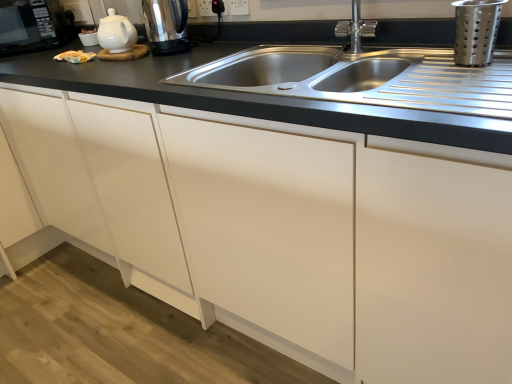
Question: Is black plastic outlet at upper center, marked as the first electric outlet in a left-to-right arrangement, bigger than white glossy teapot at upper left?

Choices:
 (A) yes
 (B) no

Answer: (B)

Question: Is there a large distance between black plastic outlet at upper center, marked as the first electric outlet in a left-to-right arrangement, and white glossy teapot at upper left?

Choices:
 (A) yes
 (B) no

Answer: (B)

Question: Does black plastic outlet at upper center, marked as the first electric outlet in a left-to-right arrangement, have a greater width compared to white glossy teapot at upper left?

Choices:
 (A) no
 (B) yes

Answer: (A)

Question: Does black plastic outlet at upper center, which appears as the second electric outlet when viewed from the right, appear on the right side of white glossy teapot at upper left?

Choices:
 (A) no
 (B) yes

Answer: (B)

Question: From the image's perspective, is black plastic outlet at upper center, marked as the first electric outlet in a left-to-right arrangement, on white glossy teapot at upper left?

Choices:
 (A) no
 (B) yes

Answer: (B)

Question: Considering the relative positions of black plastic outlet at upper center, marked as the first electric outlet in a left-to-right arrangement, and white glossy teapot at upper left in the image provided, is black plastic outlet at upper center, marked as the first electric outlet in a left-to-right arrangement, to the left of white glossy teapot at upper left from the viewer's perspective?

Choices:
 (A) yes
 (B) no

Answer: (B)

Question: From the image's perspective, is metallic silver strainer at upper right, the second appliance in the top-to-bottom sequence, beneath black plastic outlet at upper center, which appears as the second electric outlet when viewed from the right?

Choices:
 (A) no
 (B) yes

Answer: (B)

Question: Are metallic silver strainer at upper right, marked as the first appliance in a front-to-back arrangement, and black plastic outlet at upper center, marked as the first electric outlet in a left-to-right arrangement, located far from each other?

Choices:
 (A) no
 (B) yes

Answer: (A)

Question: Does metallic silver strainer at upper right, arranged as the 1th appliance when ordered from the bottom, have a lesser height compared to black plastic outlet at upper center, which appears as the second electric outlet when viewed from the right?

Choices:
 (A) no
 (B) yes

Answer: (A)

Question: Is metallic silver strainer at upper right, positioned as the 2th appliance in left-to-right order, oriented towards black plastic outlet at upper center, marked as the first electric outlet in a left-to-right arrangement?

Choices:
 (A) yes
 (B) no

Answer: (B)

Question: Considering the relative sizes of metallic silver strainer at upper right, marked as the first appliance in a front-to-back arrangement, and black plastic outlet at upper center, which appears as the second electric outlet when viewed from the right, in the image provided, is metallic silver strainer at upper right, marked as the first appliance in a front-to-back arrangement, thinner than black plastic outlet at upper center, which appears as the second electric outlet when viewed from the right,?

Choices:
 (A) yes
 (B) no

Answer: (B)

Question: Is metallic silver strainer at upper right, which is the first appliance from right to left, at the right side of black plastic outlet at upper center, which appears as the second electric outlet when viewed from the right?

Choices:
 (A) no
 (B) yes

Answer: (B)

Question: Can you confirm if black plastic outlet at upper center, which appears as the second electric outlet when viewed from the right, is taller than silver metallic faucet at upper center?

Choices:
 (A) no
 (B) yes

Answer: (A)